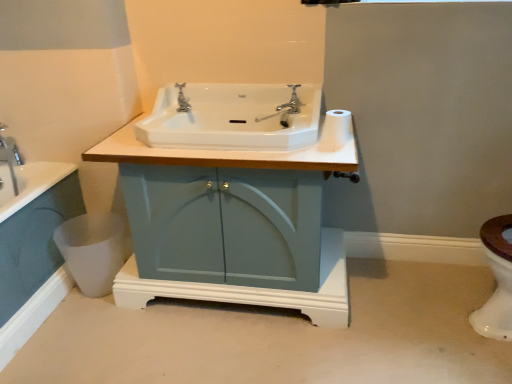
Question: Is chrome metallic faucet at upper center outside white glossy sink at center?

Choices:
 (A) no
 (B) yes

Answer: (A)

Question: Is chrome metallic faucet at upper center aimed at white glossy sink at center?

Choices:
 (A) no
 (B) yes

Answer: (B)

Question: Considering the relative positions of chrome metallic faucet at upper center and white glossy sink at center in the image provided, is chrome metallic faucet at upper center behind white glossy sink at center?

Choices:
 (A) no
 (B) yes

Answer: (B)

Question: Can you confirm if chrome metallic faucet at upper center is smaller than white glossy sink at center?

Choices:
 (A) yes
 (B) no

Answer: (A)

Question: Is chrome metallic faucet at upper center next to white glossy sink at center and touching it?

Choices:
 (A) no
 (B) yes

Answer: (A)

Question: From the image's perspective, is white glossy sink at center above or below white matte toilet paper at upper right?

Choices:
 (A) below
 (B) above

Answer: (B)

Question: Considering the positions of white glossy sink at center and white matte toilet paper at upper right in the image, is white glossy sink at center wider or thinner than white matte toilet paper at upper right?

Choices:
 (A) thin
 (B) wide

Answer: (B)

Question: In terms of height, does white glossy sink at center look taller or shorter compared to white matte toilet paper at upper right?

Choices:
 (A) tall
 (B) short

Answer: (A)

Question: From a real-world perspective, is white glossy sink at center above or below white matte toilet paper at upper right?

Choices:
 (A) above
 (B) below

Answer: (B)

Question: In terms of width, does white glossy sink at center look wider or thinner when compared to silver metallic faucet at center?

Choices:
 (A) wide
 (B) thin

Answer: (A)

Question: Is white glossy sink at center situated inside silver metallic faucet at center or outside?

Choices:
 (A) outside
 (B) inside

Answer: (A)

Question: From their relative heights in the image, would you say white glossy sink at center is taller or shorter than silver metallic faucet at center?

Choices:
 (A) tall
 (B) short

Answer: (A)

Question: Considering the positions of point (301, 94) and point (180, 102), is point (301, 94) closer or farther from the camera than point (180, 102)?

Choices:
 (A) closer
 (B) farther

Answer: (B)

Question: From the image's perspective, is white glossy toilet bowl at lower right above or below silver metallic faucet at center?

Choices:
 (A) above
 (B) below

Answer: (B)

Question: Is point (103, 266) positioned closer to the camera than point (182, 102)?

Choices:
 (A) closer
 (B) farther

Answer: (A)